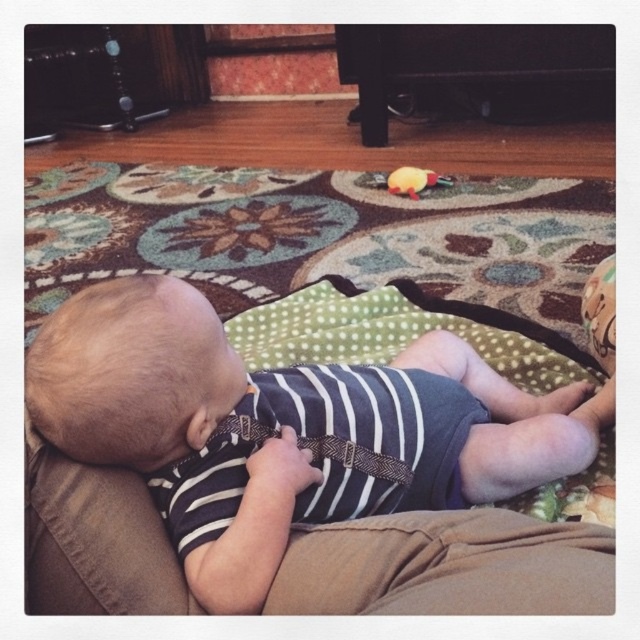
You are a parent looking at the baby in the image. The baby is wearing striped fabric baby at center and brown cotton pants at lower center. Which piece of clothing is positioned to the left?

The striped fabric baby at center is positioned to the left of the brown cotton pants at lower center.

You are a photographer trying to capture the baby lying on the couch. You notice two points in the scene labeled as point (387, 420) and point (404, 179). Which point is nearer to you when you are positioned at the camera location?

Point (387, 420) is closer to the viewer than point (404, 179), so the photographer should focus on that point to capture the nearer one.

You are a parent trying to dress your baby. You have the brown cotton pants at lower center and the yellow rubber duck at center nearby. Which item is shorter in height?

The brown cotton pants at lower center is shorter than the yellow rubber duck at center.